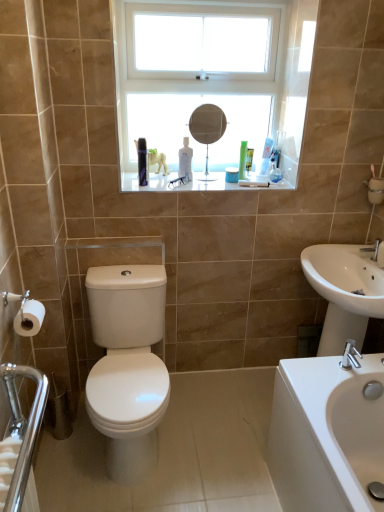
This screenshot has height=512, width=384. I want to click on vacant space behind green matte bottle at upper center, which appears as the first toiletry when ordered from the bottom, so click(241, 176).